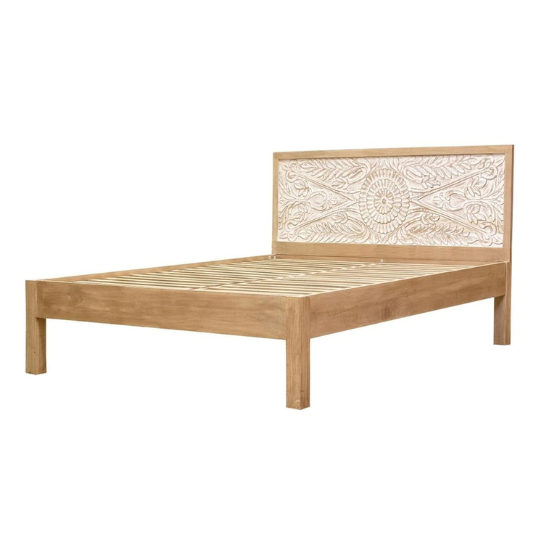
This screenshot has height=544, width=544. In order to click on empty space above bed frame in this screenshot , I will do `click(101, 191)`.